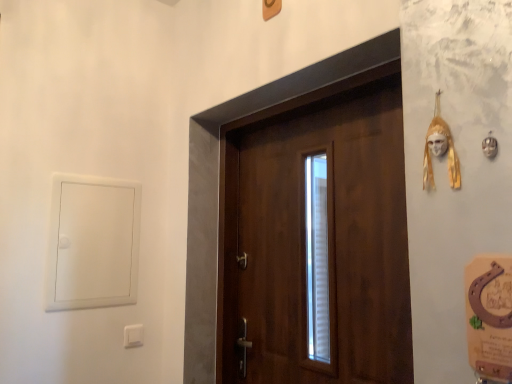
Question: Can you confirm if wooden door at center is bigger than white plastic light switch at lower left?

Choices:
 (A) yes
 (B) no

Answer: (A)

Question: Would you say white plastic light switch at lower left is part of wooden door at center's contents?

Choices:
 (A) no
 (B) yes

Answer: (A)

Question: Is wooden door at center shorter than white plastic light switch at lower left?

Choices:
 (A) yes
 (B) no

Answer: (B)

Question: Is wooden door at center placed right next to white plastic light switch at lower left?

Choices:
 (A) yes
 (B) no

Answer: (B)

Question: Considering the relative sizes of wooden door at center and white plastic light switch at lower left in the image provided, is wooden door at center smaller than white plastic light switch at lower left?

Choices:
 (A) yes
 (B) no

Answer: (B)

Question: Would you say wooden door at center is a long distance from white plastic light switch at lower left?

Choices:
 (A) no
 (B) yes

Answer: (A)

Question: From a real-world perspective, is white plastic window at left below wooden door at center?

Choices:
 (A) no
 (B) yes

Answer: (A)

Question: Is white plastic window at left aimed at wooden door at center?

Choices:
 (A) no
 (B) yes

Answer: (A)

Question: Considering the relative sizes of white plastic window at left and wooden door at center in the image provided, is white plastic window at left bigger than wooden door at center?

Choices:
 (A) no
 (B) yes

Answer: (A)

Question: Does white plastic window at left appear on the left side of wooden door at center?

Choices:
 (A) yes
 (B) no

Answer: (A)

Question: Considering the relative sizes of white plastic window at left and wooden door at center in the image provided, is white plastic window at left taller than wooden door at center?

Choices:
 (A) no
 (B) yes

Answer: (A)

Question: From the image's perspective, is white plastic window at left above wooden door at center?

Choices:
 (A) yes
 (B) no

Answer: (A)

Question: Is white plastic window at left located outside gold textured mask at upper right?

Choices:
 (A) yes
 (B) no

Answer: (A)